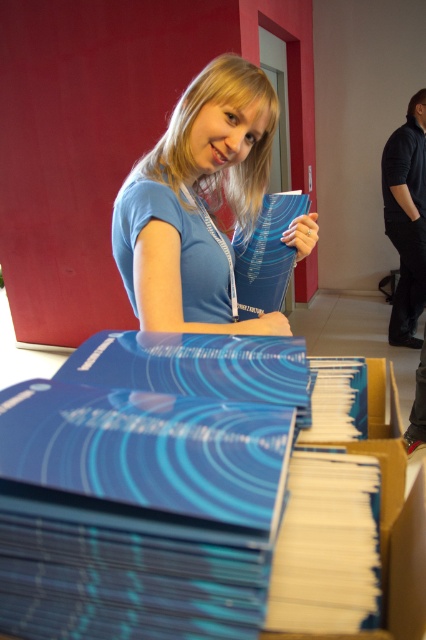
Can you confirm if blue matte book at center is positioned above matte blue book at upper center?

Indeed, blue matte book at center is positioned over matte blue book at upper center.

Between blue matte book at center and matte blue book at upper center, which one is positioned higher?

blue matte book at center

What do you see at coordinates (198, 202) in the screenshot? I see `blue matte book at center` at bounding box center [198, 202].

Identify the location of blue matte book at center. (198, 202).

Is blue glossy book at lower center below matte blue book at upper center?

Indeed, blue glossy book at lower center is positioned under matte blue book at upper center.

Between point (0, 438) and point (247, 269), which one is positioned in front?

Point (0, 438) is in front.

Does point (37, 586) come in front of point (262, 202)?

That is True.

Find the location of a particular element. The height and width of the screenshot is (640, 426). blue glossy book at lower center is located at coordinates (137, 513).

Does blue matte book at center appear on the left side of blue glossy book at lower right?

Indeed, blue matte book at center is positioned on the left side of blue glossy book at lower right.

Is blue matte book at center behind blue glossy book at lower right?

Yes, blue matte book at center is further from the viewer.

This screenshot has height=640, width=426. Identify the location of blue matte book at center. (198, 202).

Identify the location of blue matte book at center. (198, 202).